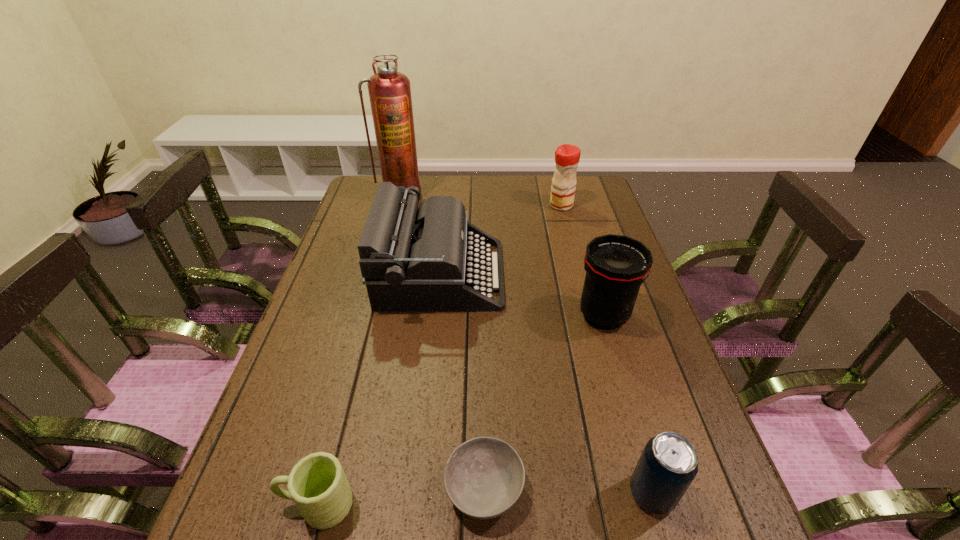
Where is `object situated at the far left corner`? object situated at the far left corner is located at coordinates (389, 91).

The image size is (960, 540). I want to click on object present at the far right corner, so click(x=567, y=157).

The height and width of the screenshot is (540, 960). I want to click on vacant position at the left edge of the desktop, so click(301, 328).

The image size is (960, 540). I want to click on vacant space at the right edge of the desktop, so click(595, 230).

In the image, there is a desktop. Where is `vacant space at the far right corner`? The height and width of the screenshot is (540, 960). vacant space at the far right corner is located at coordinates (604, 192).

This screenshot has height=540, width=960. I want to click on unoccupied position between the typewriter and the third shortest object, so click(546, 384).

This screenshot has width=960, height=540. I want to click on free space between the condiment and the typewriter, so click(501, 240).

You are a GUI agent. You are given a task and a screenshot of the screen. Output one action in this format:
    pyautogui.click(x=<x>, y=<y>)
    Task: Click on the free space between the telephoto lens and the condiment
    
    Given the screenshot: What is the action you would take?
    pyautogui.click(x=582, y=260)

The image size is (960, 540). In order to click on free spot between the mug and the condiment in this screenshot , I will do `click(439, 355)`.

At what (x,y) coordinates should I click in order to perform the action: click on vacant region between the telephoto lens and the soda can. Please return your answer as a coordinate pair (x, y). Looking at the image, I should click on (x=628, y=404).